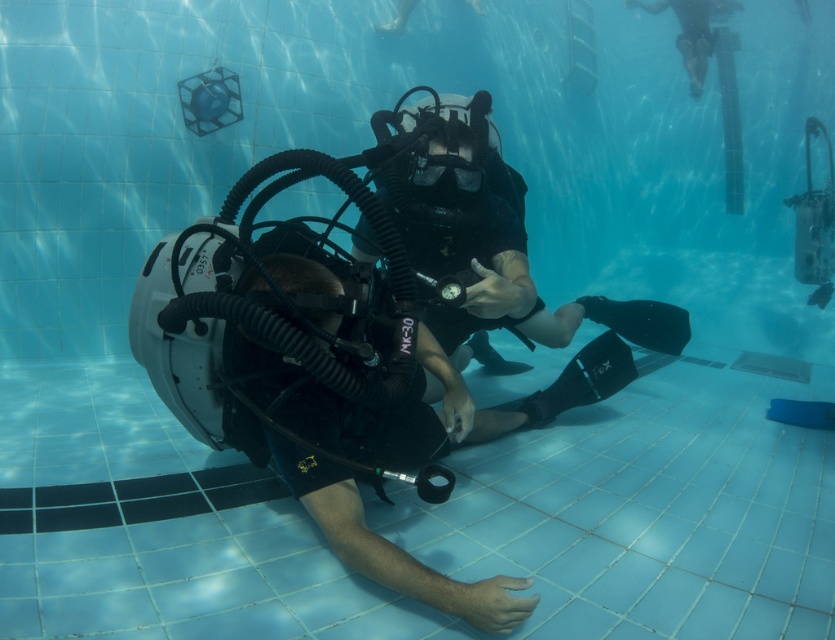
You are a lifeguard assessing the visibility of swimmers in the pool. The smooth skin at upper right and transparent plastic goggles at center are both visible to you. Which object takes up more space in your field of view?

The smooth skin at upper right is larger in size than the transparent plastic goggles at center, so it takes up more space in the field of view.

You are a lifeguard observing the underwater scene. You notice the smooth skin at upper right and the transparent plastic goggles at center. Which object is closer to you?

The smooth skin at upper right is closer to you than the transparent plastic goggles at center.

You are a safety inspector in the pool. You need to ensure that the distance between the smooth skin at upper right and the transparent plastic goggles at center is within the recommended 5 meters for safety. Is the current distance compliant?

The smooth skin at upper right is 4.28 meters away from the transparent plastic goggles at center, which is within the recommended 5 meters for safety. The distance is compliant.